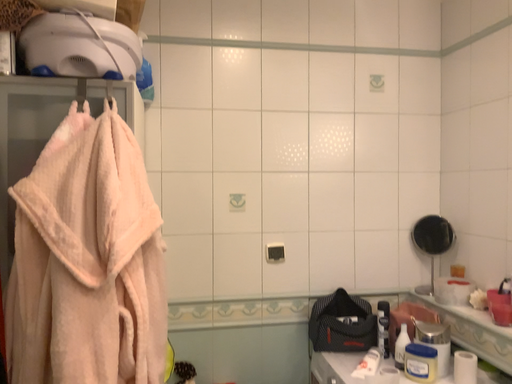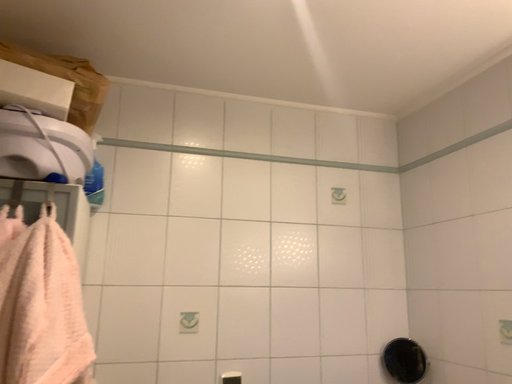
Question: How did the camera likely rotate when shooting the video?

Choices:
 (A) rotated right
 (B) rotated left

Answer: (A)